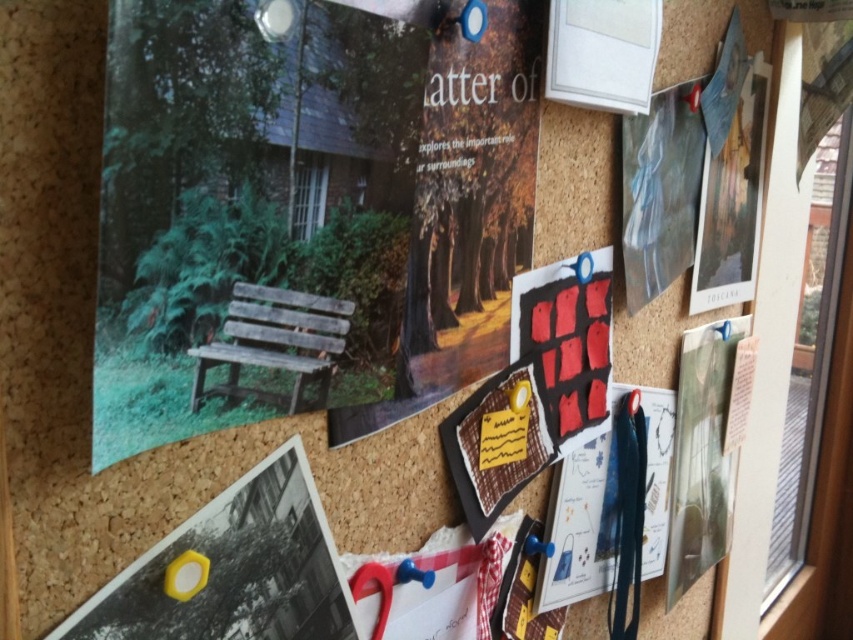
You are looking at a corkboard wall with two points marked as point 1 and point 2. Point 1 is at coordinate (415, 35) and point 2 is at (606, 506). If you were to draw a straight line between them, which point would be closer to you?

Point 1 at coordinate (415, 35) is closer to the camera than point 2 at (606, 506), so the line would start closer to you at point 1 and extend towards point 2 which is farther away.

You are standing in front of the corkboard wall and see two points pinned on it. The first point is at coordinate point (x=142, y=595) and the second is at point (x=650, y=404). Which point is closer to you?

Point (x=142, y=595) is in front of point (x=650, y=404), so it is closer to you.

You are organizing a display on the corkboard and need to ensure that all items fit within specific height requirements. The wooden bench at upper left and the yellow plastic hexagon at lower left are both pinned to the board. Which item is taller and requires more vertical space?

The wooden bench at upper left is much taller than the yellow plastic hexagon at lower left, so it requires more vertical space.